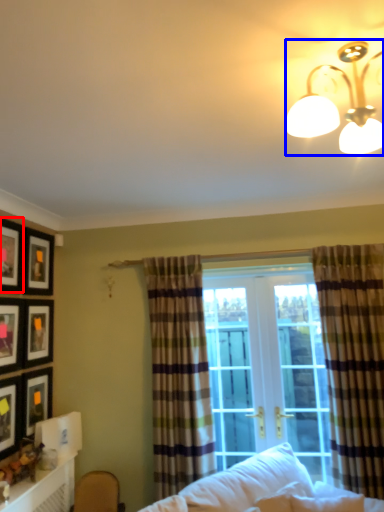
Question: Which object is closer to the camera taking this photo, picture frame (highlighted by a red box) or lamp (highlighted by a blue box)?

Choices:
 (A) picture frame
 (B) lamp

Answer: (B)